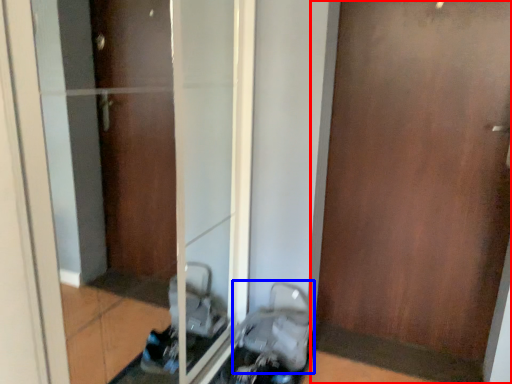
Question: Which point is closer to the camera, door (highlighted by a red box) or baby carriage (highlighted by a blue box)?

Choices:
 (A) door
 (B) baby carriage

Answer: (A)